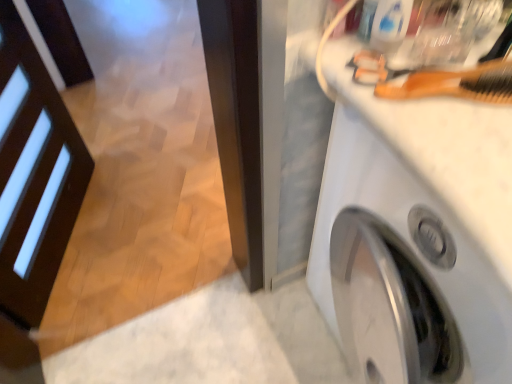
Locate an element on the screen. free point in front of wooden comb at upper right is located at coordinates (467, 157).